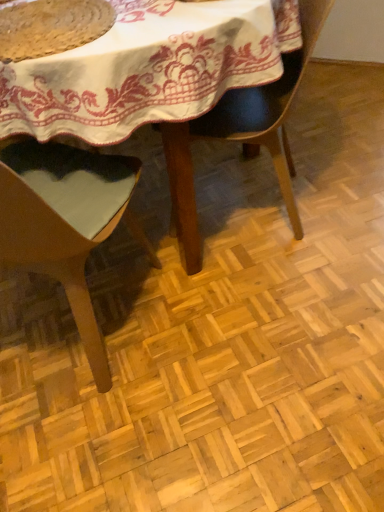
The height and width of the screenshot is (512, 384). In order to click on free space in front of matte black chair at center, placed as the first chair when sorted from right to left in this screenshot , I will do `click(266, 293)`.